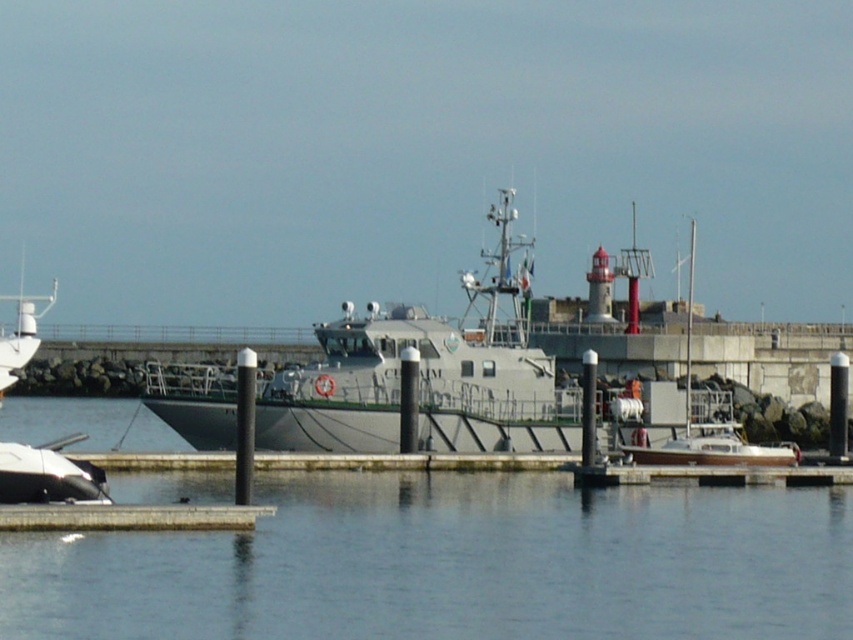
You are standing on the pier looking at the scene. Which object, the transparent water at center or the gray matte boat at center, is nearer to you?

The transparent water at center is closer to the viewer than the gray matte boat at center.